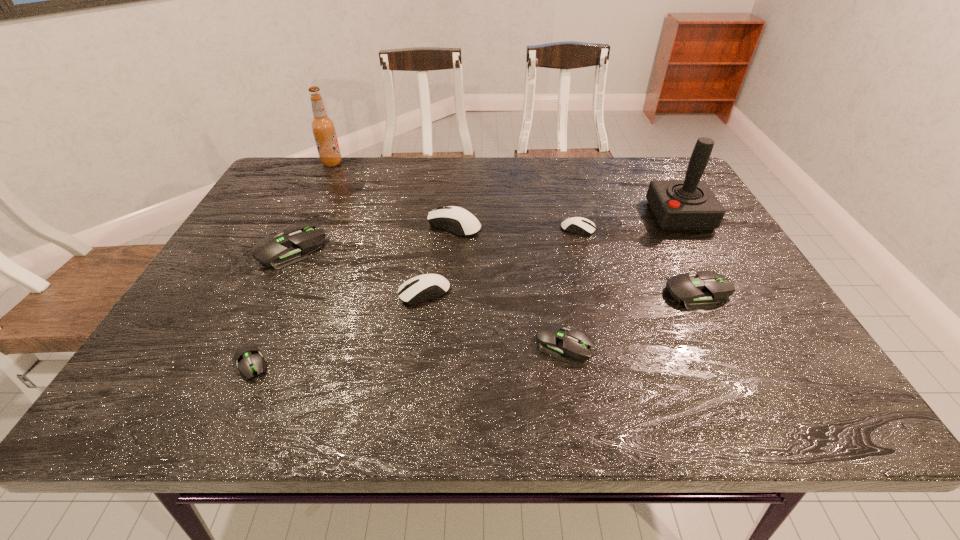
Where is `free spot at the far edge of the desktop`? Image resolution: width=960 pixels, height=540 pixels. free spot at the far edge of the desktop is located at coordinates (601, 193).

Image resolution: width=960 pixels, height=540 pixels. What are the coordinates of `vacant point at the near edge` in the screenshot? It's located at (350, 392).

You are a GUI agent. You are given a task and a screenshot of the screen. Output one action in this format:
    pyautogui.click(x=<x>, y=<y>)
    Task: Click on the blank space at the left edge of the desktop
    Image resolution: width=960 pixels, height=540 pixels.
    Given the screenshot: What is the action you would take?
    pyautogui.click(x=295, y=201)

In the image, there is a desktop. At what (x,y) coordinates should I click in order to perform the action: click on vacant space at the right edge. Please return your answer as a coordinate pair (x, y). The width and height of the screenshot is (960, 540). Looking at the image, I should click on (744, 374).

Identify the location of vacant position at the far left corner of the desktop. Image resolution: width=960 pixels, height=540 pixels. (264, 197).

You are a GUI agent. You are given a task and a screenshot of the screen. Output one action in this format:
    pyautogui.click(x=<x>, y=<y>)
    Task: Click on the free space between the rightmost gray computer mouse and the third biggest gray computer mouse
    
    Given the screenshot: What is the action you would take?
    (x=631, y=318)

The width and height of the screenshot is (960, 540). In order to click on free point between the biggest white mouse and the rightmost computer mouse in this screenshot , I will do `click(576, 259)`.

Identify the location of unoccupied area between the second biggest white mouse and the farthest gray computer mouse. The image size is (960, 540). (358, 272).

Where is `blank region between the farthest gray computer mouse and the biggest white mouse`? This screenshot has width=960, height=540. blank region between the farthest gray computer mouse and the biggest white mouse is located at coordinates (373, 238).

Identify the location of unoccupied area between the rightmost computer mouse and the smallest white mouse. (638, 261).